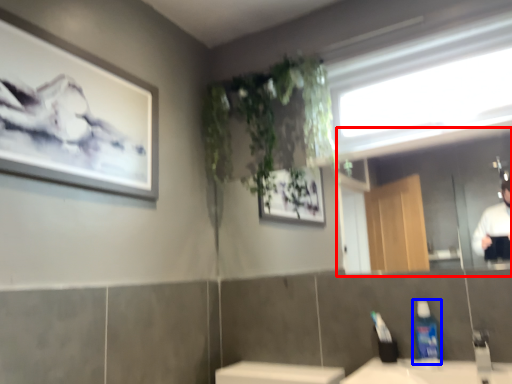
Question: Which point is further to the camera, mirror (highlighted by a red box) or cleaning product (highlighted by a blue box)?

Choices:
 (A) mirror
 (B) cleaning product

Answer: (B)